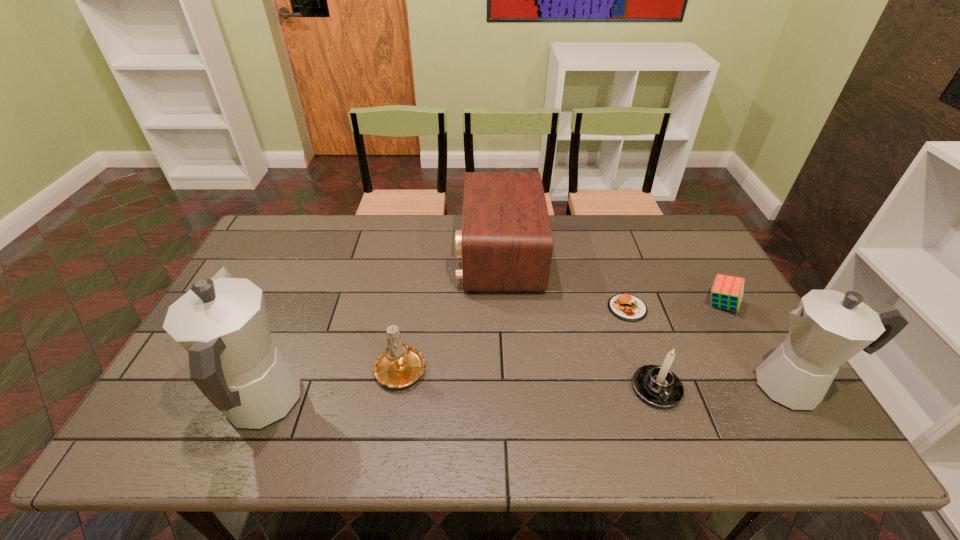
Identify the location of vacant area situated 0.110m on the back of the left coffeepot. (295, 325).

The height and width of the screenshot is (540, 960). Identify the location of vacant area located on the left of the shorter coffeepot. (658, 386).

Find the location of a particular element. vacant region located on the front panel of the radio receiver is located at coordinates (403, 256).

Identify the location of vacant position located on the front panel of the radio receiver. (397, 256).

At what (x,y) coordinates should I click in order to perform the action: click on vacant region located 0.130m on the front panel of the radio receiver. Please return your answer as a coordinate pair (x, y). This screenshot has width=960, height=540. Looking at the image, I should click on [x=419, y=256].

The width and height of the screenshot is (960, 540). I want to click on blank space located 0.320m on the left of the shortest object, so click(x=497, y=308).

Image resolution: width=960 pixels, height=540 pixels. Find the location of `free space located 0.370m on the left of the sixth tallest object`. free space located 0.370m on the left of the sixth tallest object is located at coordinates click(x=576, y=305).

I want to click on vacant space located 0.080m on the right of the candle, so click(x=458, y=367).

Locate an element on the screen. This screenshot has width=960, height=540. object located at the far edge is located at coordinates (506, 243).

The width and height of the screenshot is (960, 540). In order to click on candle that is at the near edge in this screenshot , I will do `click(400, 365)`.